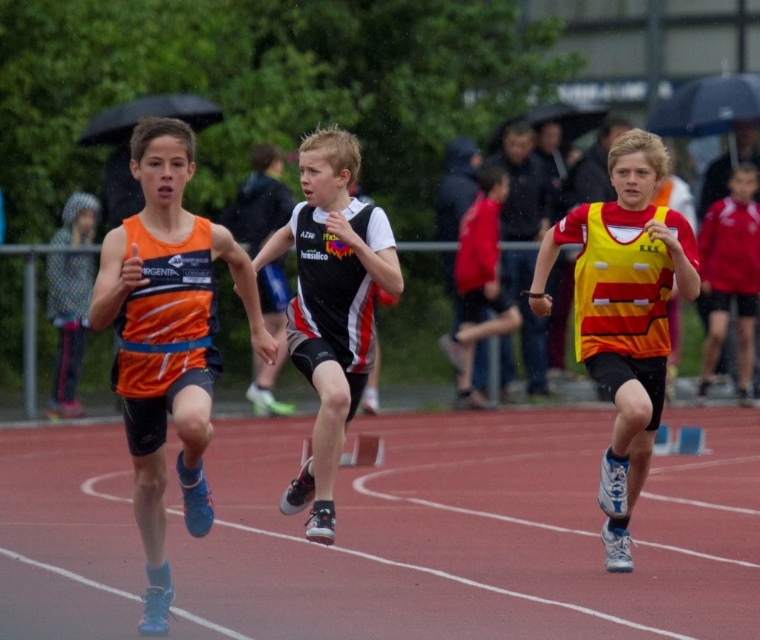
Question: Among these points, which one is nearest to the camera?

Choices:
 (A) (369, 342)
 (B) (410, 557)

Answer: (A)

Question: Can you confirm if red rubber track at center is positioned to the left of black and white jersey at center?

Choices:
 (A) no
 (B) yes

Answer: (A)

Question: In this image, where is red rubber track at center located relative to black and white jersey at center?

Choices:
 (A) left
 (B) right

Answer: (B)

Question: Which object is positioned farthest from the yellow/red striped vest at center?

Choices:
 (A) red rubber track at center
 (B) black and white jersey at center

Answer: (A)

Question: Does red rubber track at center appear under yellow/red striped vest at center?

Choices:
 (A) yes
 (B) no

Answer: (A)

Question: Estimate the real-world distances between objects in this image. Which object is farther from the yellow/red striped vest at center?

Choices:
 (A) black and white jersey at center
 (B) red rubber track at center

Answer: (B)